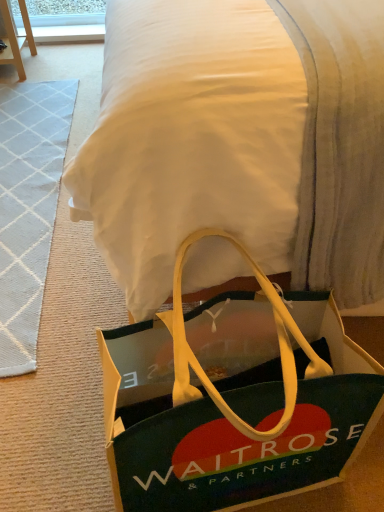
You are a GUI agent. You are given a task and a screenshot of the screen. Output one action in this format:
    pyautogui.click(x=<x>, y=<y>)
    Task: Click on the white textured rug at left
    The height and width of the screenshot is (512, 384).
    Given the screenshot: What is the action you would take?
    pyautogui.click(x=28, y=208)

In order to click on green fabric bag at lower center in this screenshot , I will do `click(240, 142)`.

Where is `handbag that appears in front of the white textured rug at left`? handbag that appears in front of the white textured rug at left is located at coordinates (234, 400).

Who is shorter, white textured rug at left or green fabric bag at lower center?

white textured rug at left is shorter.

From a real-world perspective, relative to green fabric bag at lower center, is white textured rug at left vertically above or below?

white textured rug at left is below green fabric bag at lower center.

Are white textured rug at left and green fabric bag at lower center located far from each other?

No.

Which of these two, green fabric bag at lower center or white textured rug at left, stands taller?

Standing taller between the two is green fabric bag at lower center.

You are a GUI agent. You are given a task and a screenshot of the screen. Output one action in this format:
    pyautogui.click(x=<x>, y=<y>)
    Task: Click on the handbag positioned vertically above the white textured rug at left (from a real-world perspective)
    
    Given the screenshot: What is the action you would take?
    pyautogui.click(x=234, y=400)

From a real-world perspective, relative to white textured rug at left, is green fabric bag at lower center vertically above or below?

green fabric bag at lower center is above white textured rug at left.

Is the position of green fabric bag at lower center more distant than that of green fabric bag at lower center?

Yes, the depth of green fabric bag at lower center is greater than that of green fabric bag at lower center.

Is green fabric bag at lower center inside green fabric bag at lower center?

No, green fabric bag at lower center is located outside of green fabric bag at lower center.

Does green fabric bag at lower center have a larger size compared to green fabric bag at lower center?

No, green fabric bag at lower center is not bigger than green fabric bag at lower center.

Who is taller, green fabric bag at lower center or green fabric bag at lower center?

green fabric bag at lower center.

How distant is green fabric bag at lower center from white textured rug at left?

The distance of green fabric bag at lower center from white textured rug at left is 27.61 inches.

Would you say green fabric bag at lower center is a long distance from white textured rug at left?

No, green fabric bag at lower center is not far away from white textured rug at left.

From the picture: Between green fabric bag at lower center and white textured rug at left, which one is positioned in front?

Positioned in front is green fabric bag at lower center.

Can you confirm if green fabric bag at lower center is thinner than white textured rug at left?

Incorrect, the width of green fabric bag at lower center is not less than that of white textured rug at left.

Is green fabric bag at lower center next to green fabric bag at lower center and touching it?

green fabric bag at lower center and green fabric bag at lower center are clearly separated.

Between green fabric bag at lower center and green fabric bag at lower center, which one has smaller width?

green fabric bag at lower center.

Can you confirm if green fabric bag at lower center is shorter than green fabric bag at lower center?

No.

Is green fabric bag at lower center inside the boundaries of green fabric bag at lower center, or outside?

green fabric bag at lower center is not inside green fabric bag at lower center, it's outside.

From the picture: Is white textured rug at left positioned in front of green fabric bag at lower center?

Answer: No, white textured rug at left is further to the viewer.

Which is more to the left, white textured rug at left or green fabric bag at lower center?

Positioned to the left is white textured rug at left.

Is white textured rug at left oriented away from green fabric bag at lower center?

white textured rug at left is not turned away from green fabric bag at lower center.

Which of these two, white textured rug at left or green fabric bag at lower center, stands taller?

green fabric bag at lower center is taller.

At what (x,y) coordinates should I click in order to perform the action: click on doormat behind the green fabric bag at lower center. Please return your answer as a coordinate pair (x, y). The width and height of the screenshot is (384, 512). Looking at the image, I should click on (28, 208).

Locate an element on the screen. The height and width of the screenshot is (512, 384). doormat below the green fabric bag at lower center (from a real-world perspective) is located at coordinates (28, 208).

From the image, which object appears to be farther from white textured rug at left, green fabric bag at lower center or green fabric bag at lower center?

green fabric bag at lower center is positioned further to the anchor white textured rug at left.

Consider the image. Based on their spatial positions, is white textured rug at left or green fabric bag at lower center closer to green fabric bag at lower center?

green fabric bag at lower center is positioned closer to the anchor green fabric bag at lower center.

When comparing their distances from green fabric bag at lower center, does green fabric bag at lower center or white textured rug at left seem further?

white textured rug at left lies further to green fabric bag at lower center than the other object.

From the image, which object appears to be farther from green fabric bag at lower center, green fabric bag at lower center or white textured rug at left?

Among the two, white textured rug at left is located further to green fabric bag at lower center.

Considering their positions, is green fabric bag at lower center positioned further to white textured rug at left than green fabric bag at lower center?

green fabric bag at lower center lies further to white textured rug at left than the other object.

From the picture: From the image, which object appears to be farther from green fabric bag at lower center, white textured rug at left or green fabric bag at lower center?

white textured rug at left is positioned further to the anchor green fabric bag at lower center.

Locate an element on the screen. This screenshot has height=512, width=384. handbag between white textured rug at left and green fabric bag at lower center from left to right is located at coordinates (234, 400).